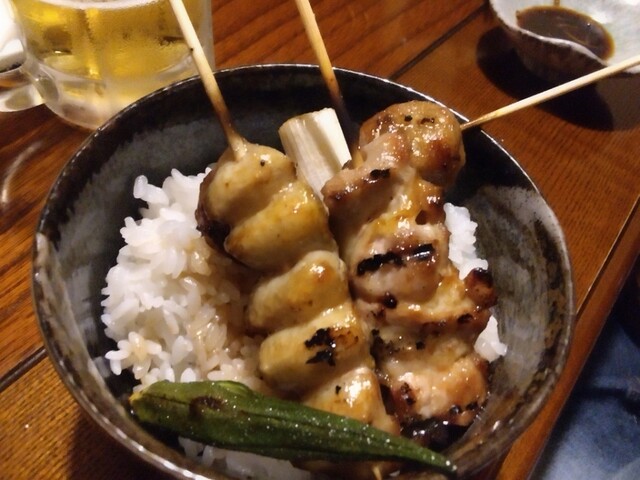
At what (x,y) coordinates should I click in order to perform the action: click on cup. Please return your answer as a coordinate pair (x, y). The image size is (640, 480). Looking at the image, I should click on (33, 92).